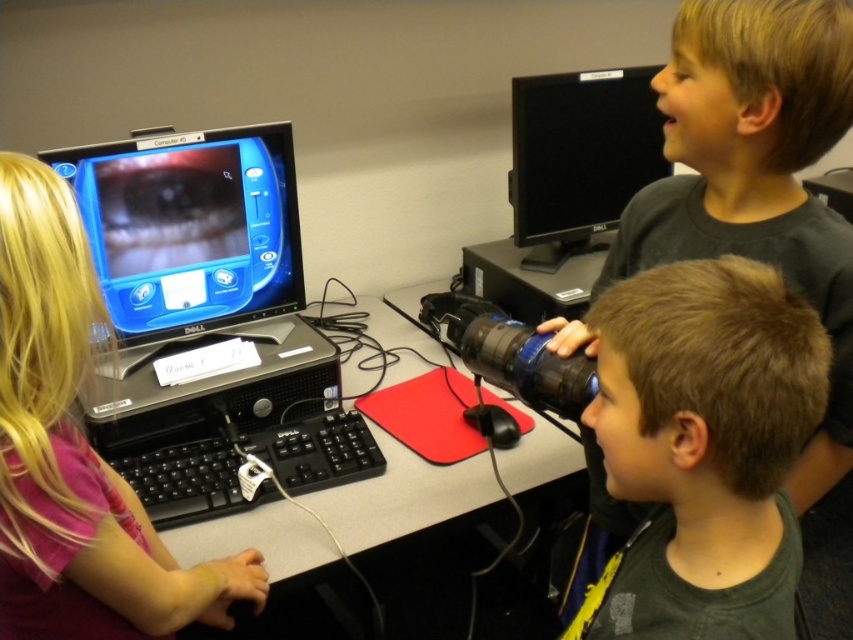
Between black glossy monitor at upper center and smooth black desk at center, which one has less height?

With less height is black glossy monitor at upper center.

Locate an element on the screen. black glossy monitor at upper center is located at coordinates (579, 157).

The image size is (853, 640). What do you see at coordinates (579, 157) in the screenshot?
I see `black glossy monitor at upper center` at bounding box center [579, 157].

Find the location of a particular element. The image size is (853, 640). black glossy monitor at upper center is located at coordinates (579, 157).

Between brown matte hair at center and pink fabric shirt at left, which one appears on the left side from the viewer's perspective?

From the viewer's perspective, pink fabric shirt at left appears more on the left side.

Locate an element on the screen. This screenshot has height=640, width=853. brown matte hair at center is located at coordinates (703, 449).

Which is above, matte black binoculars at center or black glossy monitor at left?

black glossy monitor at left is above.

Between matte black binoculars at center and black glossy monitor at left, which one has less height?

Standing shorter between the two is black glossy monitor at left.

Which is in front, point (645, 243) or point (289, 244)?

Point (645, 243)

The image size is (853, 640). What are the coordinates of `matte black binoculars at center` in the screenshot? It's located at (756, 173).